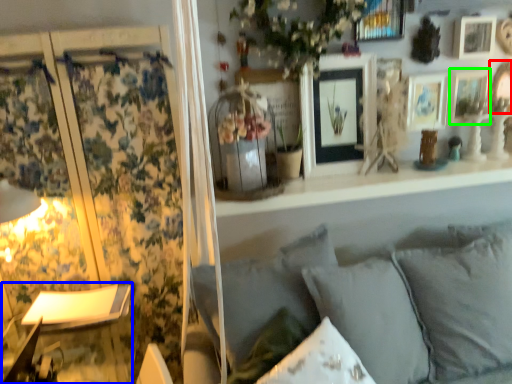
Question: Which is farther away from picture frame (highlighted by a red box)? table lamp (highlighted by a blue box) or picture frame (highlighted by a green box)?

Choices:
 (A) table lamp
 (B) picture frame

Answer: (A)